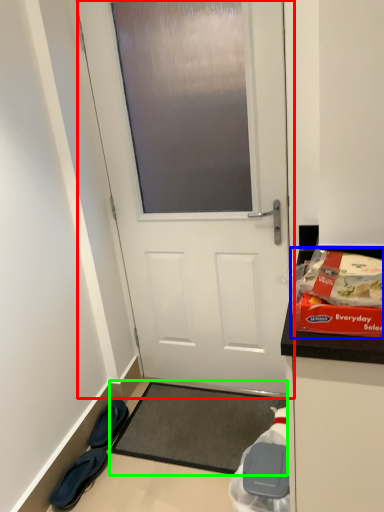
Question: Which is farther away from door (highlighted by a red box)? waste (highlighted by a blue box) or yoga mat (highlighted by a green box)?

Choices:
 (A) waste
 (B) yoga mat

Answer: (A)